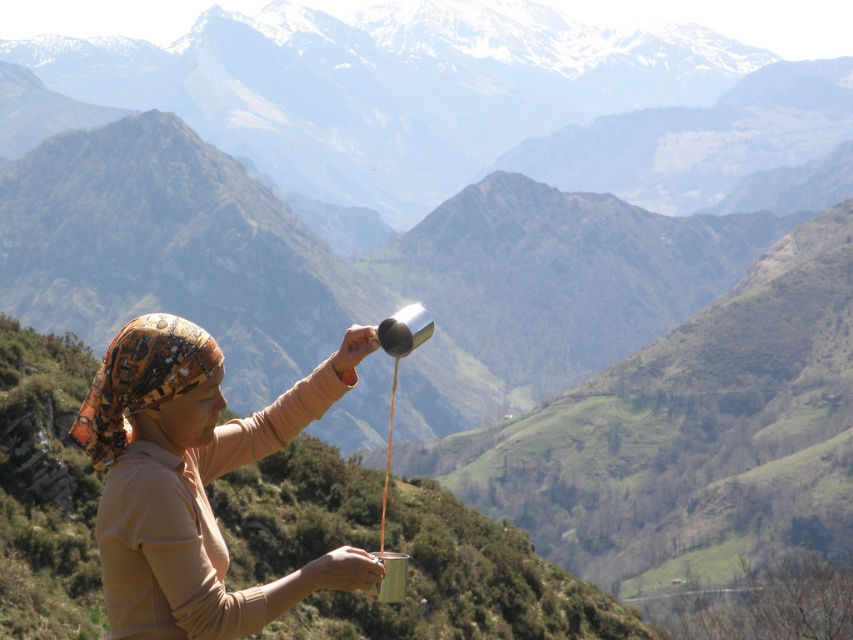
Looking at this image, you are a photographer trying to capture the matte beige shirt at center in the image. What are the exact coordinates where you should focus your camera?

The matte beige shirt at center is located at coordinates point (193, 481).

Based on the photo, you are standing at the point closest to the mountains. Which point, point [299,595] or point [170,381], is farther away from you?

Point [299,595] is behind point [170,381], so it is farther away from you.

You are an observer in the scene described. You notice the matte beige shirt at center and the printed silk headscarf at left. Which item appears narrower when viewed from your perspective?

The matte beige shirt at center has a lesser width compared to the printed silk headscarf at left, so it appears narrower.